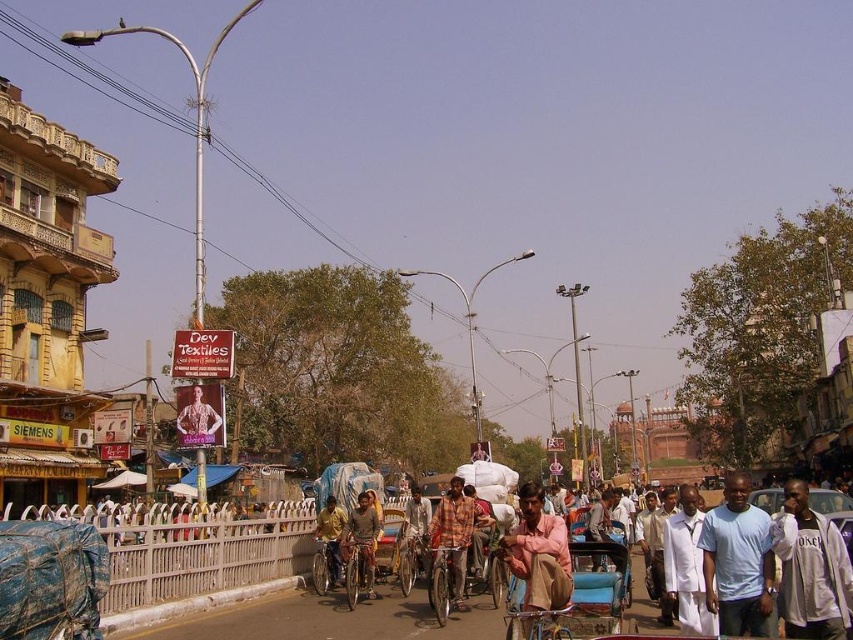
Can you confirm if white cotton shirt at center is positioned above light pink fabric at center?

No.

Which is in front, point (808, 628) or point (566, 566)?

Point (808, 628) is more forward.

The image size is (853, 640). What are the coordinates of `white cotton shirt at center` in the screenshot? It's located at (811, 568).

Between light blue t-shirt at center and brown textured shirt at center, which one is positioned lower?

brown textured shirt at center is below.

Is point (764, 532) in front of point (485, 547)?

Yes, it is in front of point (485, 547).

Find the location of `light blue t-shirt at center`. light blue t-shirt at center is located at coordinates (738, 563).

Is white cloth at center further to camera compared to brown textured shirt at center?

No, it is in front of brown textured shirt at center.

Does white cloth at center appear on the right side of brown textured shirt at center?

Correct, you'll find white cloth at center to the right of brown textured shirt at center.

Where is `white cloth at center`? This screenshot has width=853, height=640. white cloth at center is located at coordinates (688, 566).